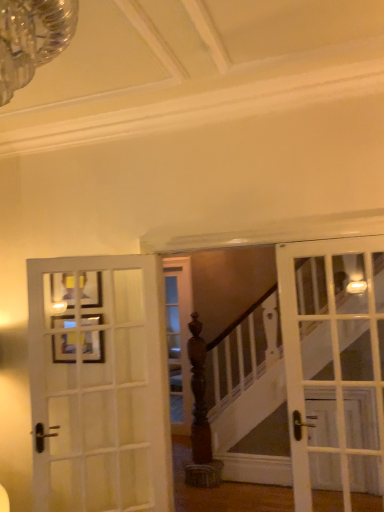
Question: From the image's perspective, relative to white glass door at right, marked as the first door in a right-to-left arrangement, is white wood door at left, arranged as the 2th door when viewed from the right, above or below?

Choices:
 (A) below
 (B) above

Answer: (A)

Question: Considering the positions of white wood door at left, arranged as the 1th door when viewed from the left, and white glass door at right, marked as the first door in a right-to-left arrangement, in the image, is white wood door at left, arranged as the 1th door when viewed from the left, wider or thinner than white glass door at right, marked as the first door in a right-to-left arrangement,?

Choices:
 (A) thin
 (B) wide

Answer: (A)

Question: Which is farther from the white wood door at left, arranged as the 1th door when viewed from the left?

Choices:
 (A) white glass door at right, marked as the first door in a right-to-left arrangement
 (B) wooden picture frame at upper left

Answer: (A)

Question: Estimate the real-world distances between objects in this image. Which object is closer to the white wood door at left, arranged as the 2th door when viewed from the right?

Choices:
 (A) white glass door at right, marked as the first door in a right-to-left arrangement
 (B) wooden picture frame at upper left

Answer: (B)